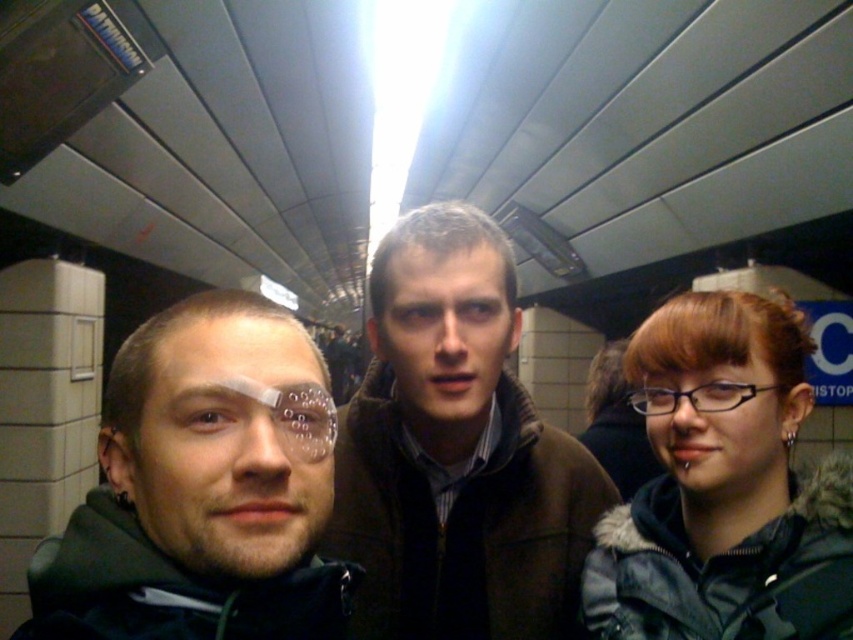
Question: Which object is farther from the camera taking this photo?

Choices:
 (A) matte blue jacket at center
 (B) dark green jacket at left
 (C) brown fuzzy jacket at center

Answer: (C)

Question: Which point is farther from the camera taking this photo?

Choices:
 (A) (782, 518)
 (B) (181, 460)

Answer: (A)

Question: Does dark green jacket at left have a lesser width compared to matte blue jacket at center?

Choices:
 (A) no
 (B) yes

Answer: (A)

Question: Can you confirm if brown fuzzy jacket at center is wider than dark green jacket at left?

Choices:
 (A) no
 (B) yes

Answer: (B)

Question: Estimate the real-world distances between objects in this image. Which object is farther from the matte blue jacket at center?

Choices:
 (A) dark green jacket at left
 (B) brown fuzzy jacket at center

Answer: (A)

Question: Is the position of brown fuzzy jacket at center less distant than that of matte blue jacket at center?

Choices:
 (A) no
 (B) yes

Answer: (A)